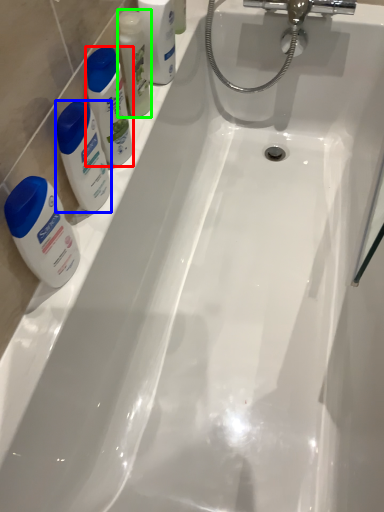
Question: Considering the real-world distances, which object is closest to cleaning product (highlighted by a red box)? cleaning product (highlighted by a blue box) or mouthwash (highlighted by a green box).

Choices:
 (A) cleaning product
 (B) mouthwash

Answer: (A)